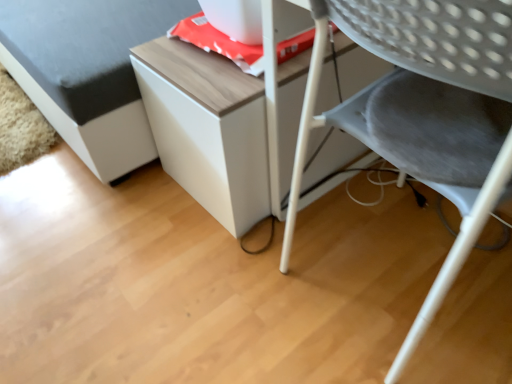
Identify the location of vacant region under gray fabric chair at lower right (from a real-world perspective). The image size is (512, 384). (386, 262).